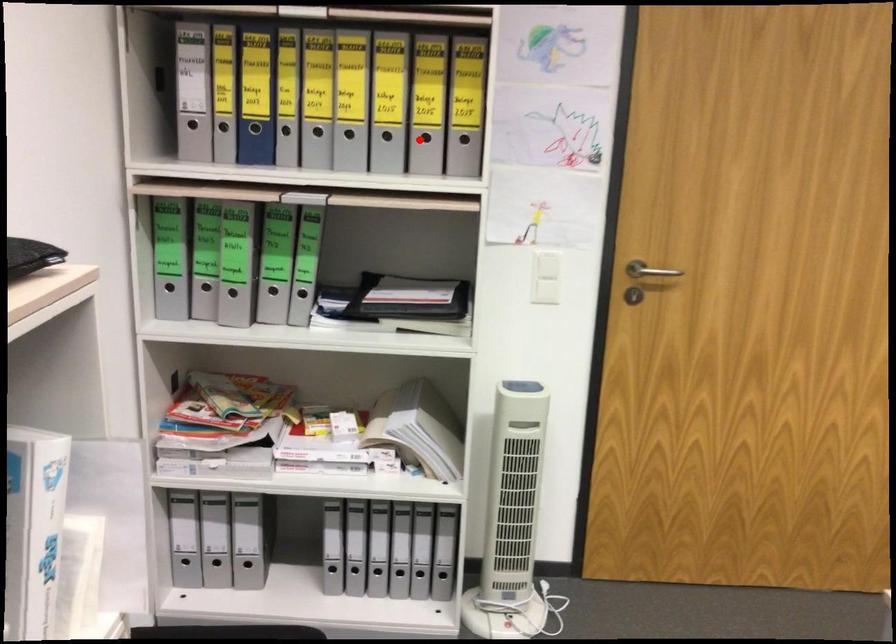
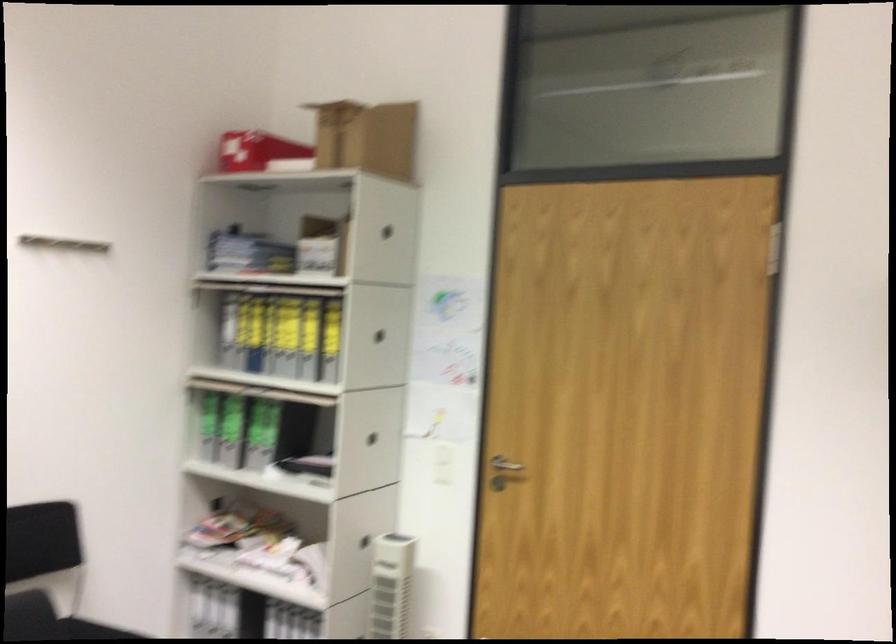
The point at the highlighted location is marked in the first image. Where is the corresponding point in the second image?

(330, 359)